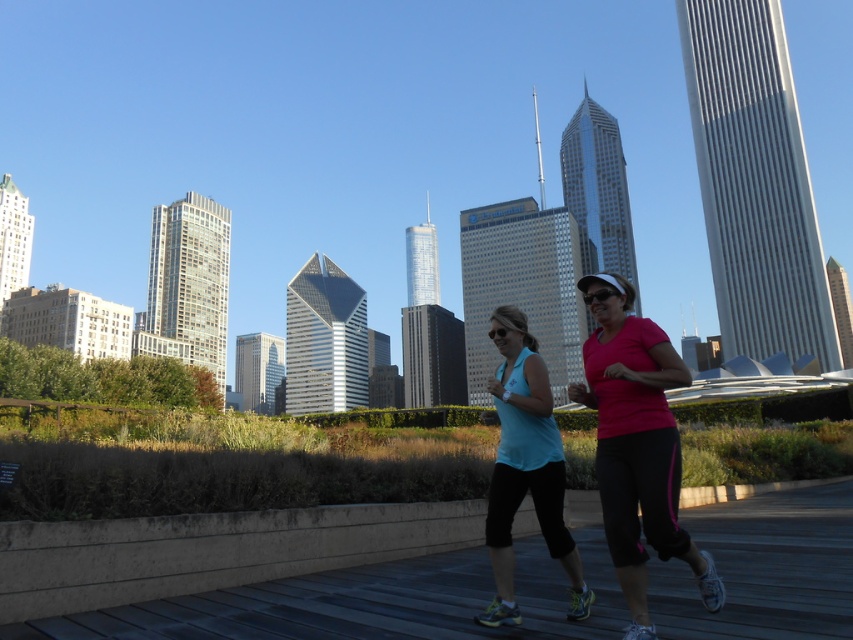
Can you confirm if matte pink shirt at center is positioned above matte blue tank top at center?

Correct, matte pink shirt at center is located above matte blue tank top at center.

Can you confirm if matte pink shirt at center is positioned below matte blue tank top at center?

Incorrect, matte pink shirt at center is not positioned below matte blue tank top at center.

The width and height of the screenshot is (853, 640). In order to click on matte pink shirt at center in this screenshot , I will do `click(636, 444)`.